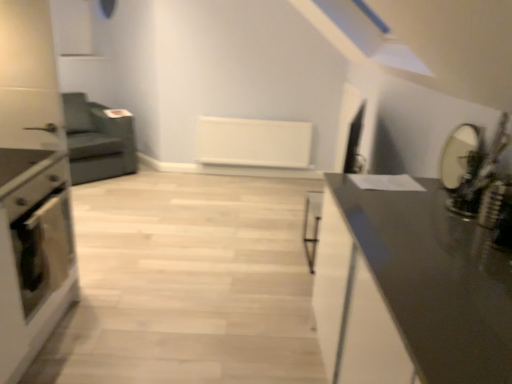
Where is `vacant area situated below white matte radiator at center (from a real-world perspective)`? This screenshot has width=512, height=384. vacant area situated below white matte radiator at center (from a real-world perspective) is located at coordinates (253, 175).